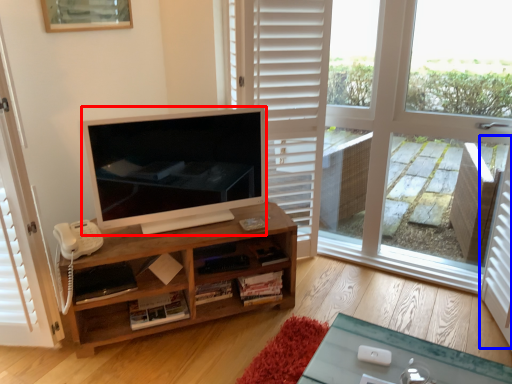
Question: Which point is closer to the camera, television (highlighted by a red box) or screen door (highlighted by a blue box)?

Choices:
 (A) television
 (B) screen door

Answer: (B)